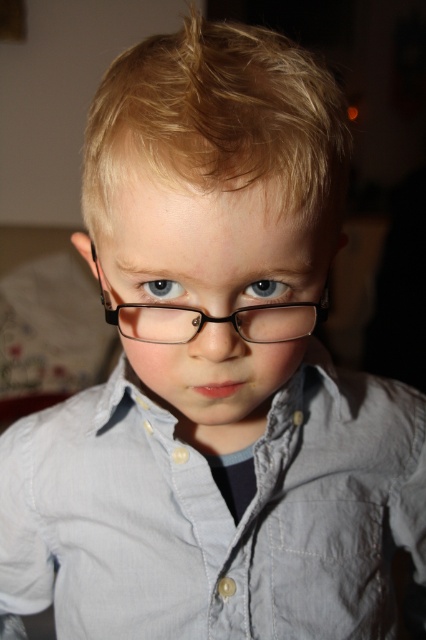
You are a tailor who needs to adjust the light blue cotton dress shirt at center to fit the child properly. Considering the blue glossy eye at center, which part of the shirt should you adjust to ensure it doesn not interfere with the eye area?

The light blue cotton dress shirt at center is wider than the blue glossy eye at center. To avoid interference with the eye area, the tailor should adjust the width of the light blue cotton dress shirt at center to be narrower than the blue glossy eye at center.

Looking at the child in the image, which eye has the blue glossy eye at center compared to the blue matte eye at center?

The blue glossy eye at center is to the left of the blue matte eye at center.

You are a photographer adjusting the lighting in the studio. You notice a point at coordinates [215,515]. Based on the scene description, what object is this point located on?

The point at coordinates [215,515] is located on the light blue cotton dress shirt at center.